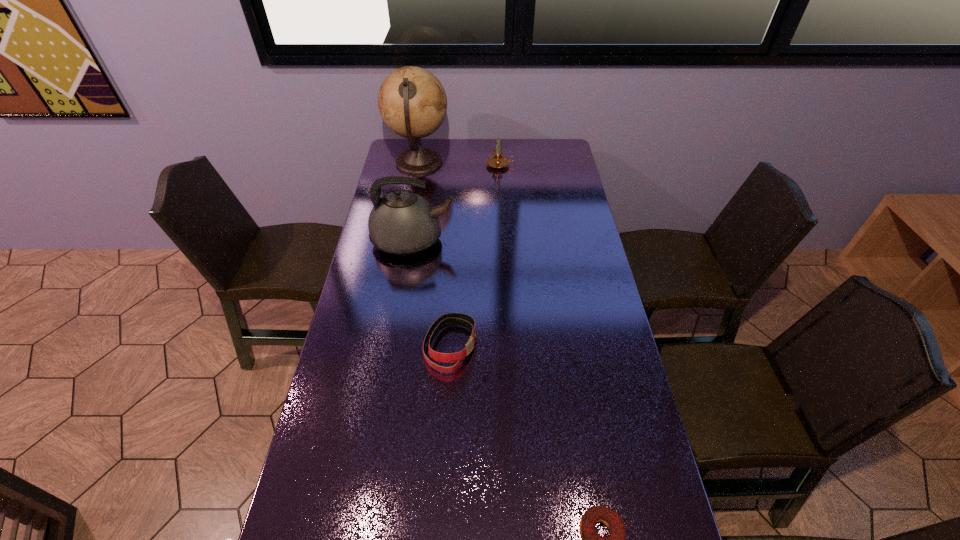
You are a GUI agent. You are given a task and a screenshot of the screen. Output one action in this format:
    pyautogui.click(x=<x>, y=<y>)
    Task: Click on the vacant region located on the left of the fourth tallest object
    
    Given the screenshot: What is the action you would take?
    pyautogui.click(x=353, y=346)

You are a GUI agent. You are given a task and a screenshot of the screen. Output one action in this format:
    pyautogui.click(x=<x>, y=<y>)
    Task: Click on the globe that is at the far edge
    
    Given the screenshot: What is the action you would take?
    pyautogui.click(x=412, y=102)

Identify the location of candle that is at the far edge. The height and width of the screenshot is (540, 960). (497, 161).

Find the location of a particular element. This screenshot has height=540, width=960. globe present at the left edge is located at coordinates (412, 102).

Where is `kettle at the left edge`? kettle at the left edge is located at coordinates (403, 223).

Where is `object located at the far left corner`? object located at the far left corner is located at coordinates (412, 102).

What are the coordinates of `blank space at the far edge` in the screenshot? It's located at (523, 156).

Locate an element on the screen. This screenshot has height=540, width=960. blank area at the left edge is located at coordinates (362, 460).

Locate an element on the screen. vacant space at the right edge of the desktop is located at coordinates (565, 197).

Locate an element on the screen. free region at the far right corner of the desktop is located at coordinates (547, 152).